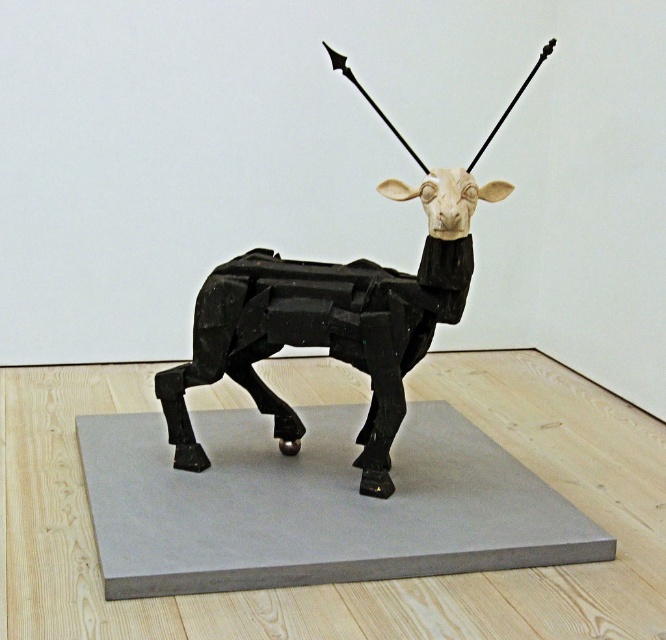
Which is behind, point (258, 440) or point (362, 266)?

Point (258, 440)

Who is taller, gray matte platform at center or matte black sculpture at center?

Standing taller between the two is matte black sculpture at center.

Based on the photo, who is more forward, (482, 508) or (456, 204)?

Point (456, 204) is in front.

Where is `gray matte platform at center`? This screenshot has height=640, width=666. gray matte platform at center is located at coordinates tap(314, 504).